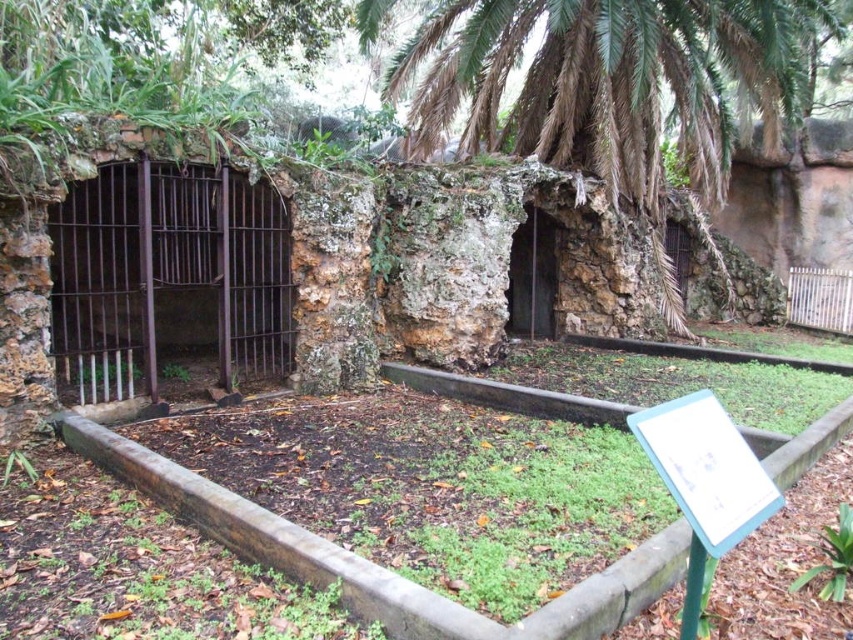
Question: Which point is closer to the camera?

Choices:
 (A) (670, 65)
 (B) (212, 328)
 (C) (715, 429)

Answer: (C)

Question: Which point appears farthest from the camera in this image?

Choices:
 (A) (592, 152)
 (B) (729, 547)
 (C) (91, 232)

Answer: (A)

Question: Which object is positioned closest to the rusty metal cage at left?

Choices:
 (A) green plastic sign at lower right
 (B) green leafy palm tree at center

Answer: (A)

Question: Is green leafy palm tree at center further to camera compared to rusty metal cage at left?

Choices:
 (A) no
 (B) yes

Answer: (B)

Question: Does rusty metal cage at left appear on the left side of green plastic sign at lower right?

Choices:
 (A) yes
 (B) no

Answer: (A)

Question: Is green leafy palm tree at center closer to camera compared to rusty metal cage at left?

Choices:
 (A) no
 (B) yes

Answer: (A)